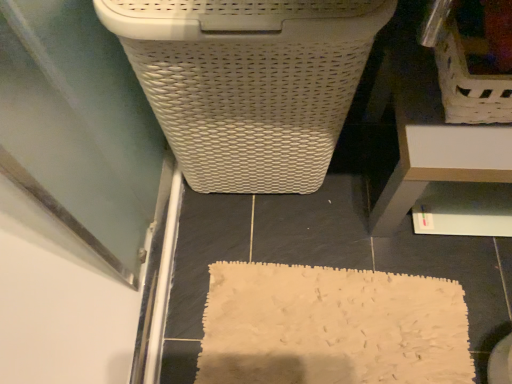
Question: Is white plastic drawer at lower right smaller than transparent glass screen door at lower left?

Choices:
 (A) yes
 (B) no

Answer: (B)

Question: Is white plastic drawer at lower right closer to the viewer compared to transparent glass screen door at lower left?

Choices:
 (A) no
 (B) yes

Answer: (B)

Question: Considering the relative sizes of white plastic drawer at lower right and transparent glass screen door at lower left in the image provided, is white plastic drawer at lower right wider than transparent glass screen door at lower left?

Choices:
 (A) yes
 (B) no

Answer: (B)

Question: Would you say white plastic drawer at lower right contains transparent glass screen door at lower left?

Choices:
 (A) no
 (B) yes

Answer: (A)

Question: Can you confirm if white plastic drawer at lower right is taller than transparent glass screen door at lower left?

Choices:
 (A) yes
 (B) no

Answer: (A)

Question: Does white plastic drawer at lower right have a larger size compared to transparent glass screen door at lower left?

Choices:
 (A) yes
 (B) no

Answer: (A)

Question: Considering the relative positions of white woven laundry basket at upper center and white plastic drawer at lower right in the image provided, is white woven laundry basket at upper center to the left of white plastic drawer at lower right from the viewer's perspective?

Choices:
 (A) no
 (B) yes

Answer: (B)

Question: From a real-world perspective, does white woven laundry basket at upper center sit lower than white plastic drawer at lower right?

Choices:
 (A) no
 (B) yes

Answer: (A)

Question: Does white woven laundry basket at upper center have a smaller size compared to white plastic drawer at lower right?

Choices:
 (A) no
 (B) yes

Answer: (A)

Question: Can you confirm if white woven laundry basket at upper center is thinner than white plastic drawer at lower right?

Choices:
 (A) no
 (B) yes

Answer: (B)

Question: Would you say white woven laundry basket at upper center contains white plastic drawer at lower right?

Choices:
 (A) yes
 (B) no

Answer: (B)

Question: Can you confirm if white woven laundry basket at upper center is shorter than white plastic drawer at lower right?

Choices:
 (A) yes
 (B) no

Answer: (B)

Question: Does white plastic drawer at lower right appear on the right side of white woven laundry basket at upper center?

Choices:
 (A) yes
 (B) no

Answer: (A)